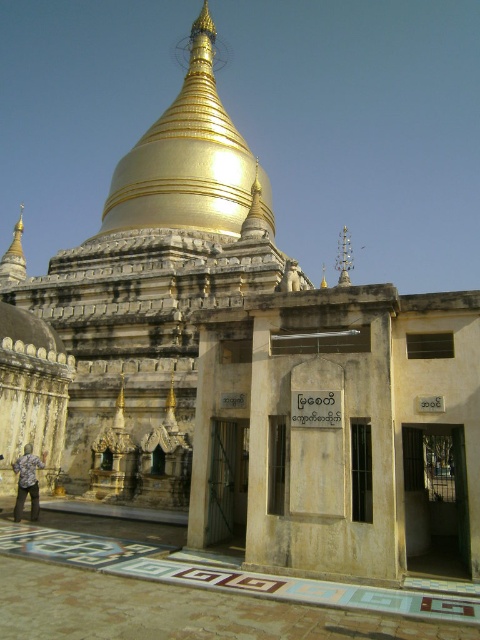
Question: Is gold polished dome at center thinner than printed cotton shirt at lower left?

Choices:
 (A) no
 (B) yes

Answer: (A)

Question: In this image, where is gold polished dome at center located relative to printed cotton shirt at lower left?

Choices:
 (A) right
 (B) left

Answer: (A)

Question: Which point appears farthest from the camera in this image?

Choices:
 (A) (237, 196)
 (B) (34, 509)

Answer: (A)

Question: Where is gold polished dome at center located in relation to printed cotton shirt at lower left in the image?

Choices:
 (A) above
 (B) below

Answer: (A)

Question: Which point is farther to the camera?

Choices:
 (A) gold polished dome at center
 (B) printed cotton shirt at lower left

Answer: (A)